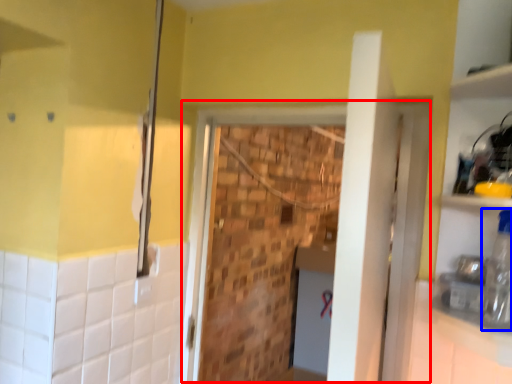
Question: Which of the following is the farthest to the observer, screen door (highlighted by a red box) or bottle (highlighted by a blue box)?

Choices:
 (A) screen door
 (B) bottle

Answer: (A)